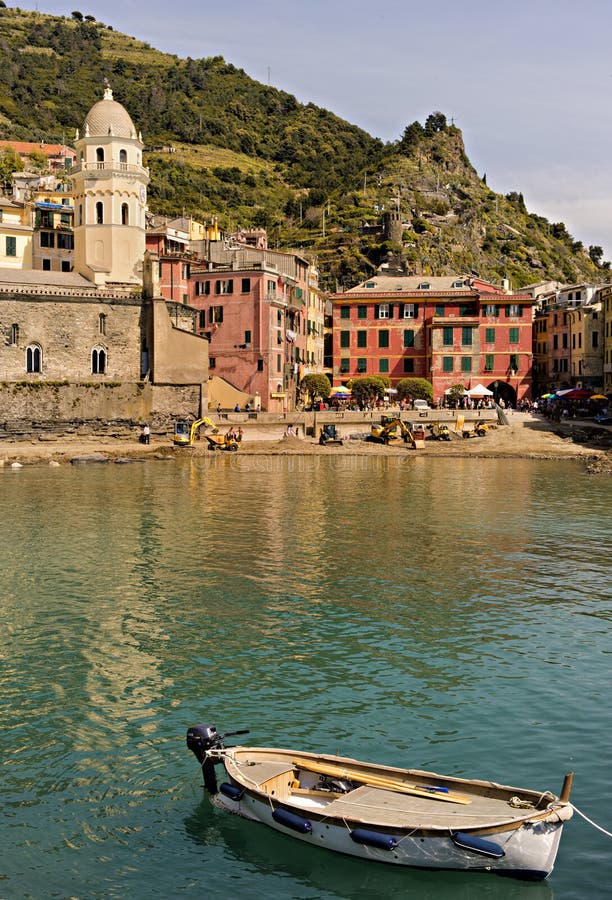
At what (x,y) coordinates should I click in order to perform the action: click on window. Please return your answer as a coordinate pair (x, y). The width and height of the screenshot is (612, 900). Looking at the image, I should click on (463, 338).